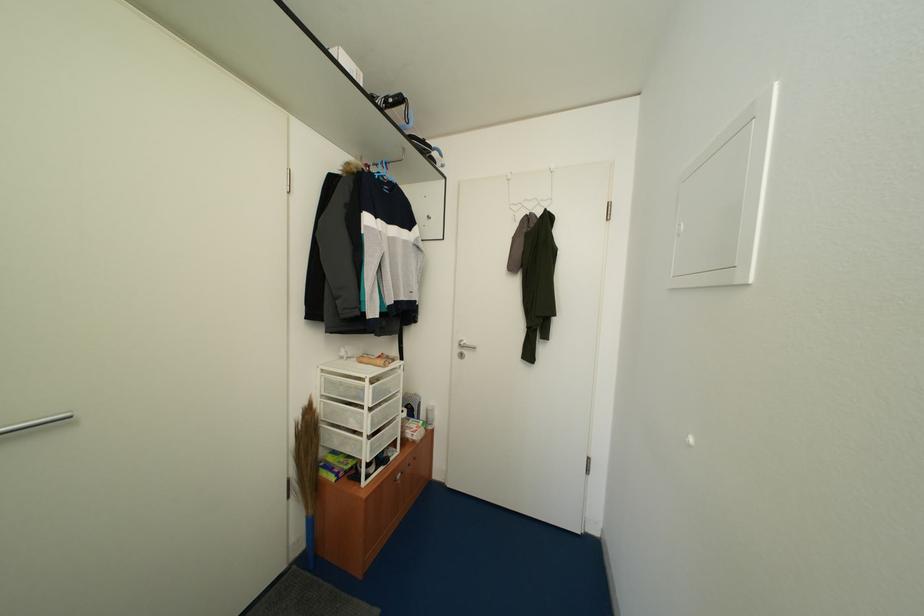
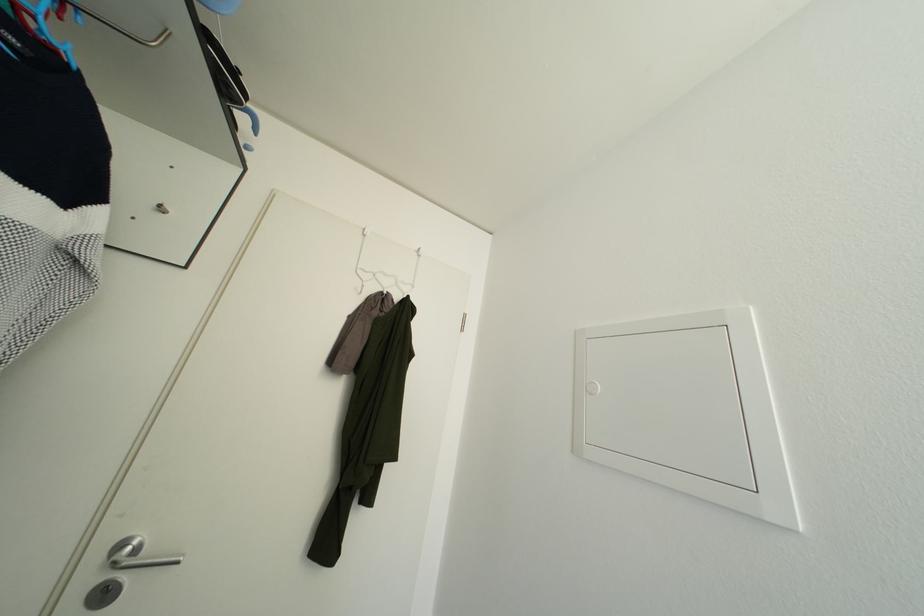
Question: I am providing you with two images of the same scene from different viewpoints. Please identify which objects are invisible in image2.

Choices:
 (A) over-door clothes hanger
 (B) silver door handle
 (C) white panel latch
 (D) none of these

Answer: (D)